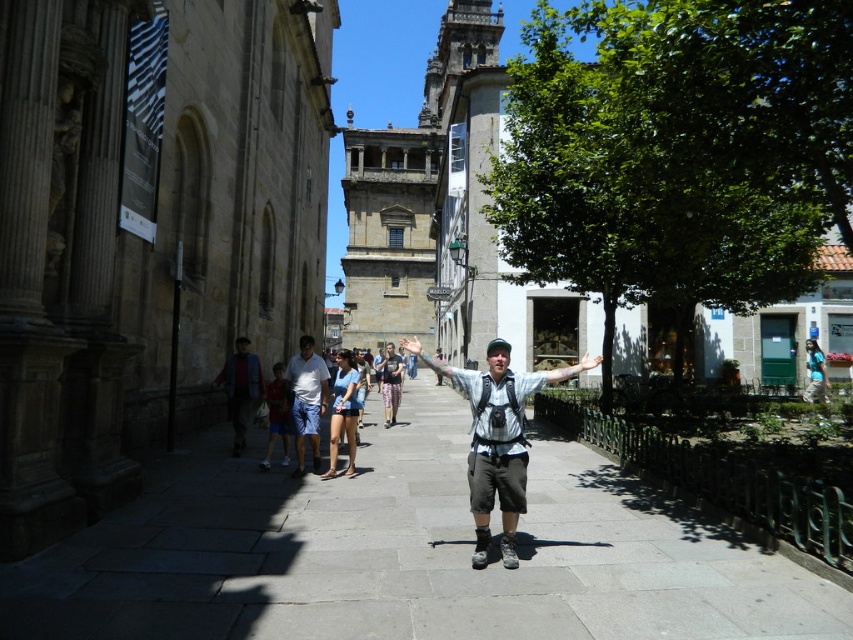
Question: Based on their relative distances, which object is farther from the matte gray arm at center?

Choices:
 (A) floral pants at center
 (B) matte black hand at center
 (C) gray stone pavement at center

Answer: (B)

Question: Which is farther from the light blue denim shorts at center?

Choices:
 (A) gray stone pavement at center
 (B) matte black hand at center
 (C) matte gray arm at center
 (D) dark gray shorts at center

Answer: (C)

Question: Is dark gray shorts at center above denim shorts at center?

Choices:
 (A) yes
 (B) no

Answer: (B)

Question: Among these points, which one is farthest from the camera?

Choices:
 (A) (488, 496)
 (B) (384, 422)
 (C) (305, 403)

Answer: (B)

Question: Considering the relative positions of gray stone pavement at center and light blue denim shorts at center in the image provided, where is gray stone pavement at center located with respect to light blue denim shorts at center?

Choices:
 (A) left
 (B) right

Answer: (B)

Question: Is the position of floral pants at center more distant than that of light gray fabric arm at center?

Choices:
 (A) yes
 (B) no

Answer: (A)